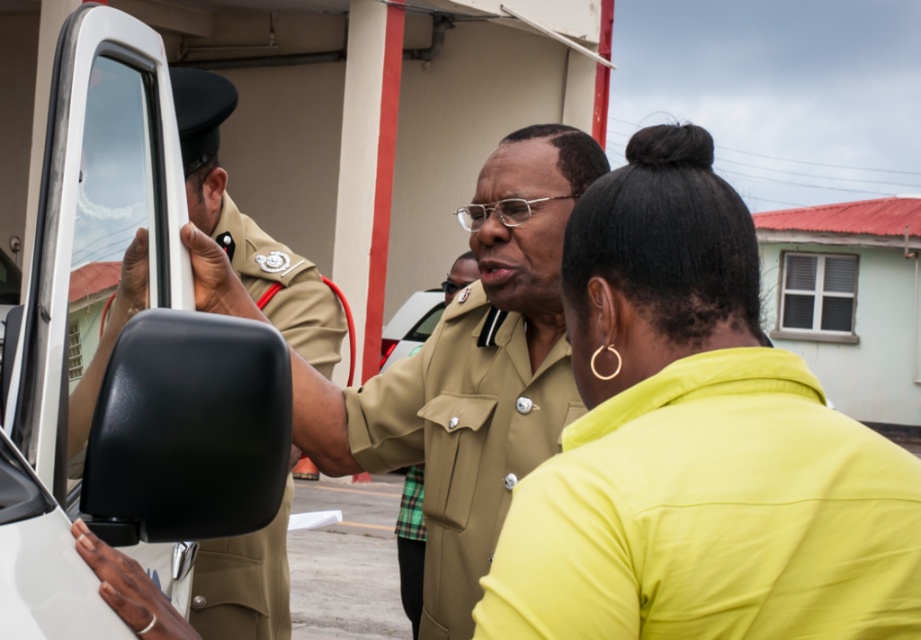
You are a security guard standing in the middle of the room. You see the kaki fabric uniform at center and the matte khaki uniform at left. Which one is closer to you?

The kaki fabric uniform at center is closer to you because it is further to the viewer than the matte khaki uniform at left.

Please provide the 2D coordinates of the kaki fabric uniform at center in the image. The answer should be in the format of a point with two decimal places, like 0.5,0.5.

The 2D coordinates of the kaki fabric uniform at center are at point (463, 438).

You are an observer standing in the same room as the yellow matte shirt at center and the matte khaki uniform at left. Which of the two takes up more visual space in the scene?

The matte khaki uniform at left takes up more visual space than the yellow matte shirt at center because the yellow matte shirt at center occupies less space than the matte khaki uniform at left.